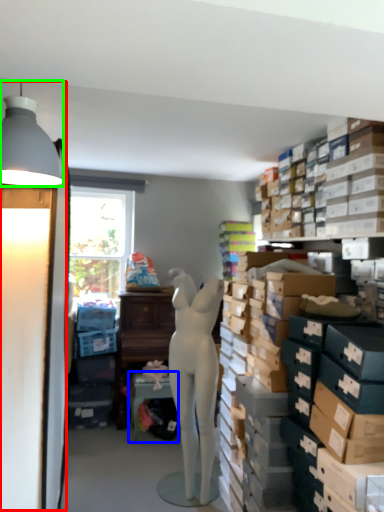
Question: Considering the real-world distances, which object is farthest from table lamp (highlighted by a red box)? table (highlighted by a blue box) or lamp (highlighted by a green box)?

Choices:
 (A) table
 (B) lamp

Answer: (A)